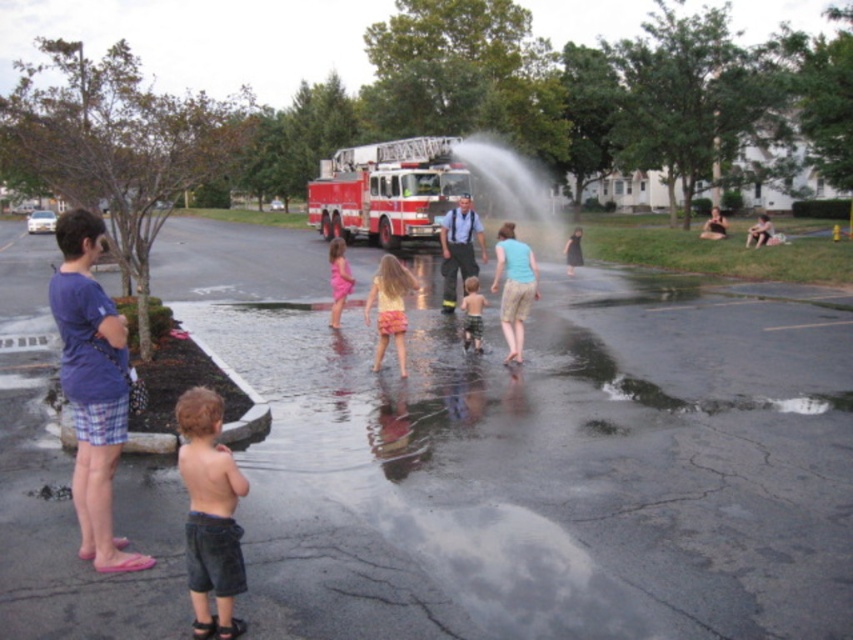
In the scene shown: Who is higher up, red glossy fire truck at center or denim shorts at lower left?

Positioned higher is red glossy fire truck at center.

Is red glossy fire truck at center smaller than denim shorts at lower left?

No.

Between point (434, 179) and point (213, 634), which one is positioned in front?

Point (213, 634) is more forward.

This screenshot has height=640, width=853. Find the location of `red glossy fire truck at center`. red glossy fire truck at center is located at coordinates (387, 189).

Is clear water at center positioned in front of green plaid shorts at center?

Yes, clear water at center is closer to the viewer.

Who is more distant from viewer, [479,417] or [471,300]?

The point [471,300] is behind.

In order to click on clear water at center in this screenshot , I will do `click(555, 468)`.

Is clear water at center above pink fabric dress at center?

Actually, clear water at center is below pink fabric dress at center.

Is the position of clear water at center more distant than that of pink fabric dress at center?

No, clear water at center is closer to the viewer.

Is point (390, 564) less distant than point (339, 269)?

Yes.

I want to click on clear water at center, so click(x=555, y=468).